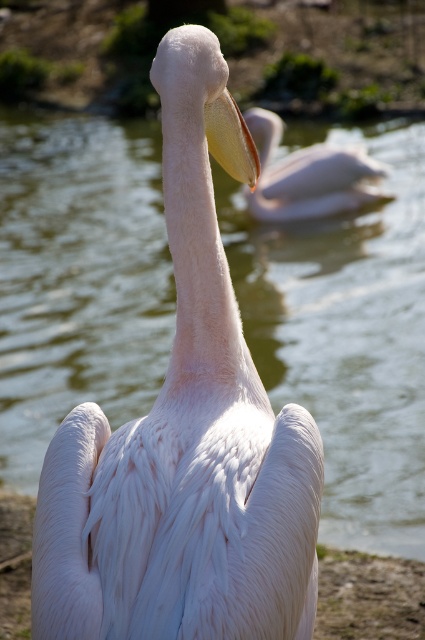
Question: Is white feathered pelican at center to the left of white matte pelican at center from the viewer's perspective?

Choices:
 (A) no
 (B) yes

Answer: (B)

Question: Among these points, which one is nearest to the camera?

Choices:
 (A) (272, 200)
 (B) (116, 616)

Answer: (B)

Question: Is white feathered pelican at center bigger than white matte pelican at center?

Choices:
 (A) yes
 (B) no

Answer: (B)

Question: Can you confirm if white feathered pelican at center is positioned above white matte pelican at center?

Choices:
 (A) no
 (B) yes

Answer: (A)